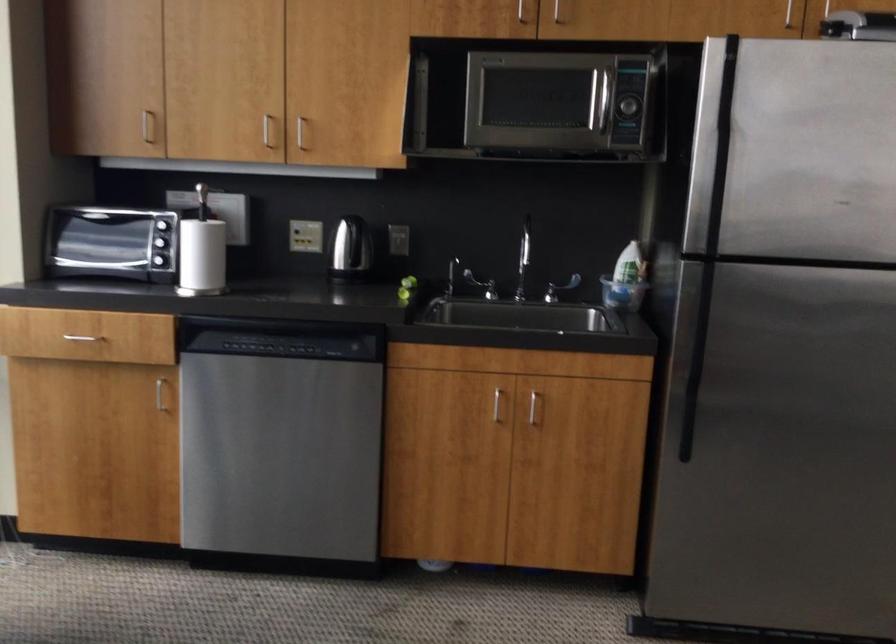
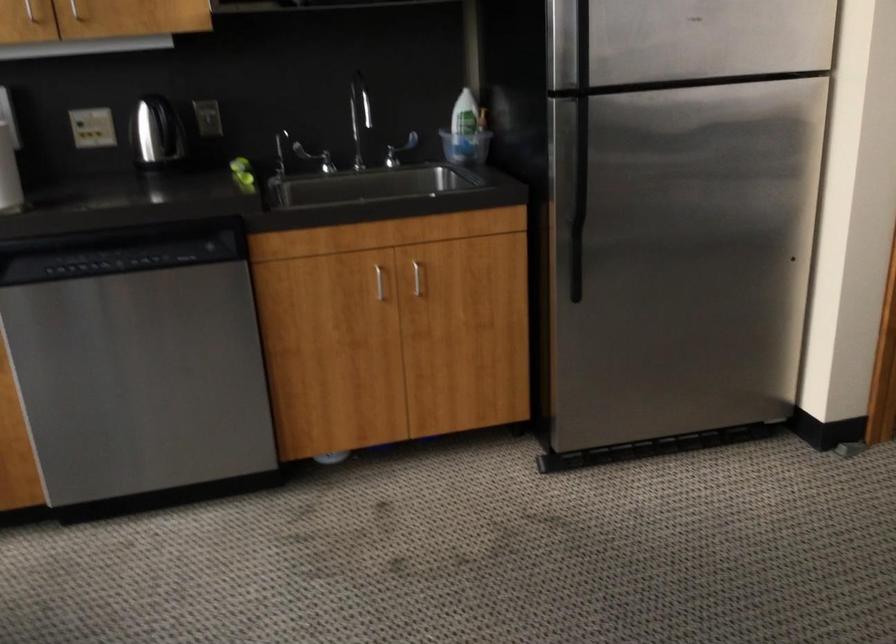
Question: The first image is from the beginning of the video and the second image is from the end. How did the camera likely rotate when shooting the video?

Choices:
 (A) Left
 (B) Right
 (C) Up
 (D) Down

Answer: (B)